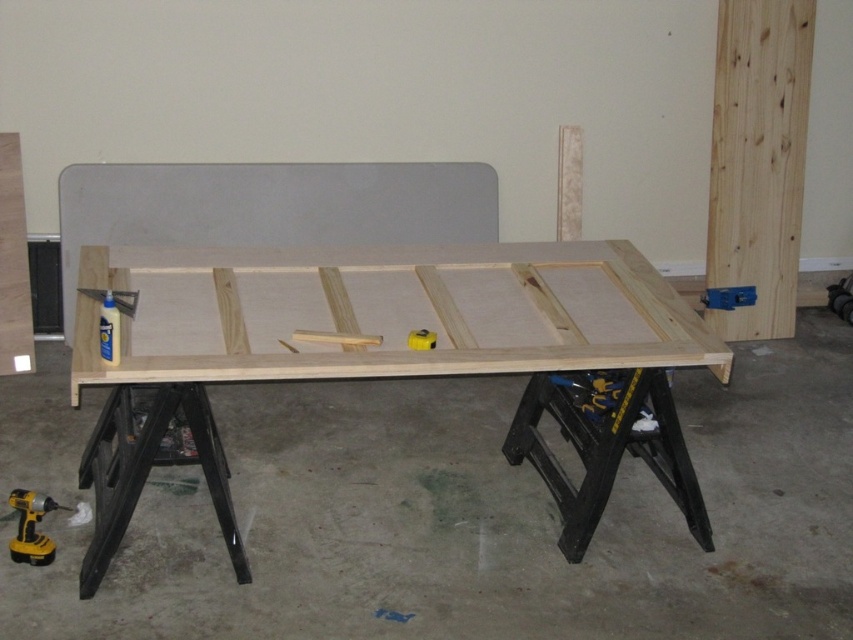
Question: Among these points, which one is nearest to the camera?

Choices:
 (A) (717, 298)
 (B) (39, 509)
 (C) (426, 346)
 (D) (747, 250)

Answer: (C)

Question: Estimate the real-world distances between objects in this image. Which object is closer to the natural wood table at center?

Choices:
 (A) yellow plastic drill at lower left
 (B) natural wood door at right
 (C) yellow rubber at center

Answer: (C)

Question: Where is natural wood door at right located in relation to yellow rubber at center in the image?

Choices:
 (A) left
 (B) right

Answer: (B)

Question: Can you confirm if yellow plastic drill at lower left is positioned to the right of yellow rubber at center?

Choices:
 (A) yes
 (B) no

Answer: (B)

Question: Which point is closer to the camera?

Choices:
 (A) (27, 515)
 (B) (415, 332)
 (C) (726, 104)
 (D) (664, 400)

Answer: (B)

Question: In this image, where is blue plastic clamp at center-right located relative to yellow rubber at center?

Choices:
 (A) above
 (B) below

Answer: (A)